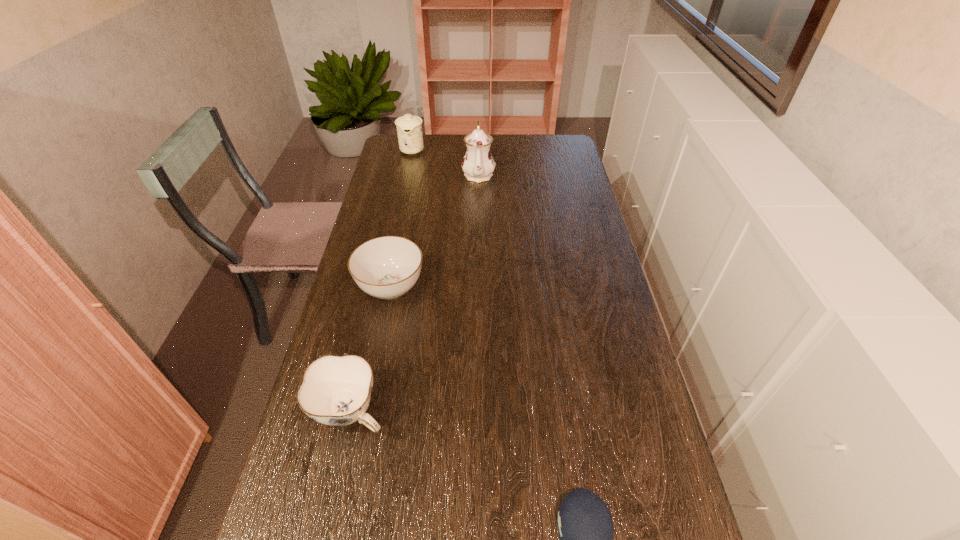
At what (x,y) coordinates should I click in order to perform the action: click on empty location between the second farthest chinaware and the nearest chinaware. Please return your answer as a coordinate pair (x, y). Looking at the image, I should click on (415, 293).

Find the location of a particular element. Image resolution: width=960 pixels, height=540 pixels. free point between the nearest chinaware and the third farthest object is located at coordinates (371, 349).

This screenshot has height=540, width=960. I want to click on vacant region between the fourth farthest object and the second farthest object, so click(415, 293).

Where is `the second closest object to the nearest chinaware`? the second closest object to the nearest chinaware is located at coordinates (585, 526).

Select which object is the fourth closest to the fourth object from left to right. Please provide its 2D coordinates. Your answer should be formatted as a tuple, i.e. [(x, y)], where the tuple contains the x and y coordinates of a point satisfying the conditions above.

[(585, 526)]

Identify which chinaware is the nearest to the nearest object. Please provide its 2D coordinates. Your answer should be formatted as a tuple, i.e. [(x, y)], where the tuple contains the x and y coordinates of a point satisfying the conditions above.

[(336, 390)]

Where is `the second closest chinaware relative to the second nearest chinaware`? the second closest chinaware relative to the second nearest chinaware is located at coordinates (478, 164).

Image resolution: width=960 pixels, height=540 pixels. I want to click on free space that satisfies the following two spatial constraints: 1. on the spout of the third shortest chinaware; 2. on the right side of the second object from right to left, so click(407, 174).

At what (x,y) coordinates should I click in order to perform the action: click on free space that satisfies the following two spatial constraints: 1. on the spout of the farthest object; 2. on the left side of the tallest chinaware. Please return your answer as a coordinate pair (x, y). Looking at the image, I should click on (407, 174).

Where is `free location that satisfies the following two spatial constraints: 1. on the back side of the tallest chinaware; 2. on the right side of the third farthest object`? The image size is (960, 540). free location that satisfies the following two spatial constraints: 1. on the back side of the tallest chinaware; 2. on the right side of the third farthest object is located at coordinates (414, 174).